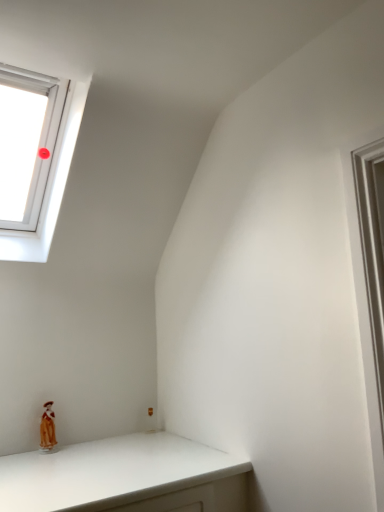
Question: From a real-world perspective, is white plastic window at upper left physically located above or below porcelain doll at lower left?

Choices:
 (A) above
 (B) below

Answer: (A)

Question: Is point (56, 217) closer or farther from the camera than point (48, 434)?

Choices:
 (A) farther
 (B) closer

Answer: (A)

Question: Would you say white plastic window at upper left is inside or outside porcelain doll at lower left?

Choices:
 (A) outside
 (B) inside

Answer: (A)

Question: From a real-world perspective, relative to white plastic window at upper left, is porcelain doll at lower left vertically above or below?

Choices:
 (A) above
 (B) below

Answer: (B)

Question: From the image's perspective, relative to white plastic window at upper left, is porcelain doll at lower left above or below?

Choices:
 (A) below
 (B) above

Answer: (A)

Question: Is porcelain doll at lower left taller or shorter than white plastic window at upper left?

Choices:
 (A) tall
 (B) short

Answer: (B)

Question: Based on their positions, is porcelain doll at lower left located to the left or right of white plastic window at upper left?

Choices:
 (A) left
 (B) right

Answer: (B)